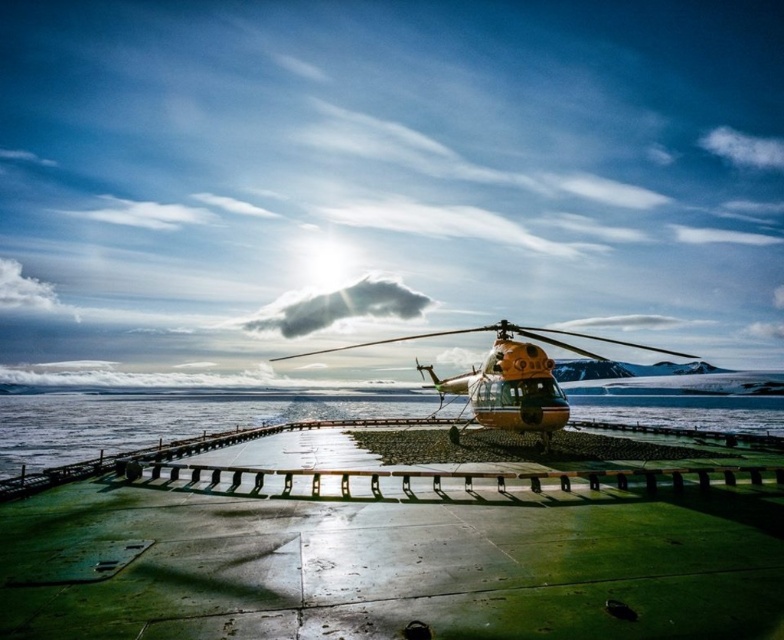
Question: Which object is closer to the camera taking this photo?

Choices:
 (A) green concrete dock at center
 (B) orange matte helicopter at center

Answer: (A)

Question: Based on their relative distances, which object is nearer to the translucent ice water at center?

Choices:
 (A) green concrete dock at center
 (B) orange matte helicopter at center

Answer: (B)

Question: Can you confirm if green concrete dock at center is thinner than orange matte helicopter at center?

Choices:
 (A) no
 (B) yes

Answer: (A)

Question: From the image, what is the correct spatial relationship of green concrete dock at center in relation to translucent ice water at center?

Choices:
 (A) above
 (B) below

Answer: (A)

Question: Which object appears closest to the camera in this image?

Choices:
 (A) translucent ice water at center
 (B) orange matte helicopter at center
 (C) green concrete dock at center

Answer: (C)

Question: Is green concrete dock at center further to camera compared to translucent ice water at center?

Choices:
 (A) no
 (B) yes

Answer: (A)